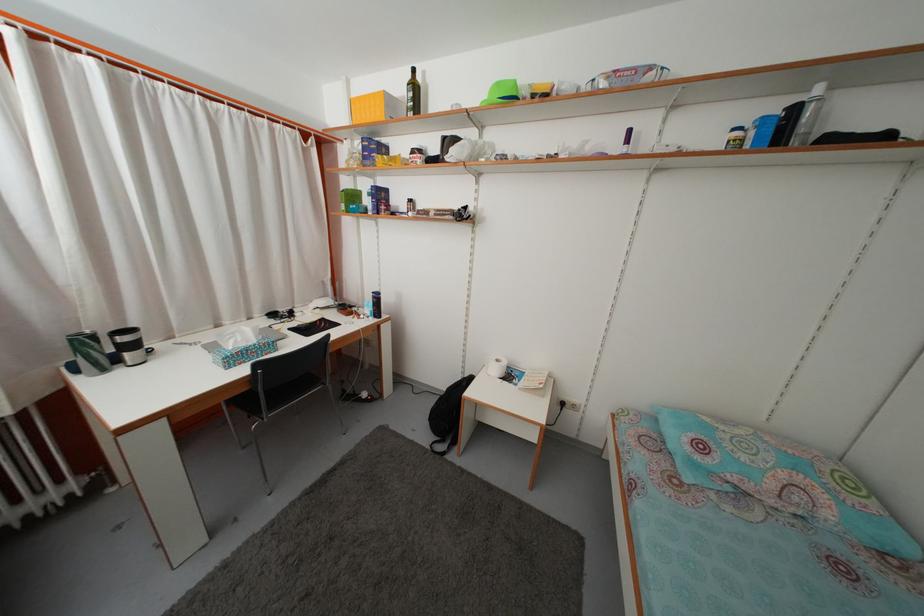
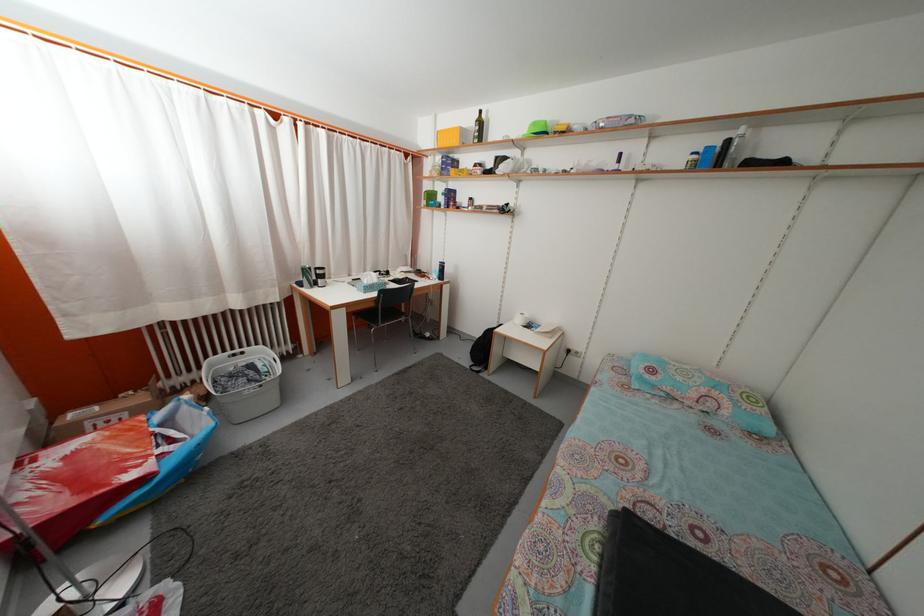
Where in the second image is the point corresponding to [394,108] from the first image?

(468, 139)